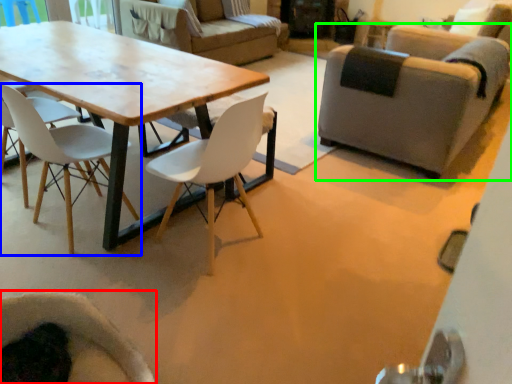
Question: Considering the real-world distances, which object is farthest from chair (highlighted by a red box)? chair (highlighted by a blue box) or chair (highlighted by a green box)?

Choices:
 (A) chair
 (B) chair

Answer: (B)